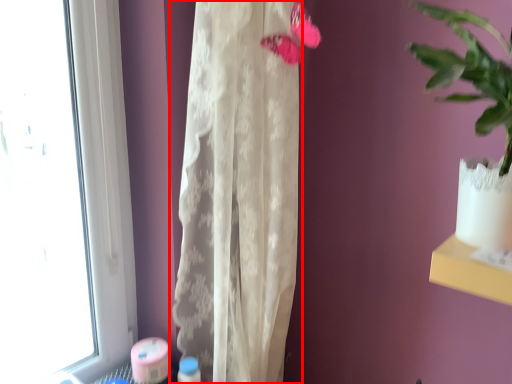
Question: From the image's perspective, what is the correct spatial positioning of curtain (annotated by the red box) in reference to flower?

Choices:
 (A) below
 (B) above

Answer: (A)